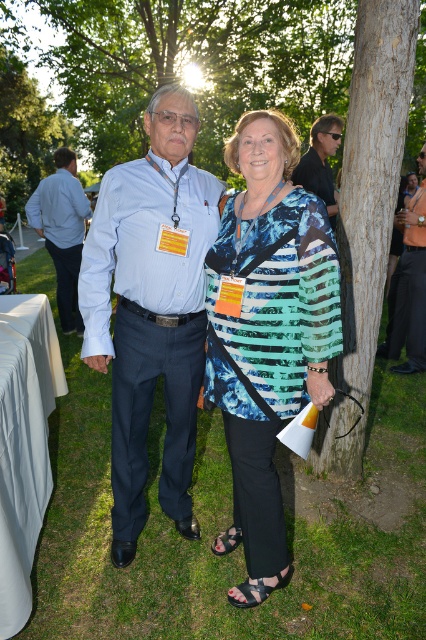
You are a photographer at the event and want to ensure that both the printed fabric top at center and the matte blue shirt at center are clearly visible in your photo. Given that your camera has a minimum focus distance of 12 inches, will you need to adjust your position to capture both subjects adequately?

The printed fabric top at center and the matte blue shirt at center are 12.47 inches apart from each other. Since the distance between them is greater than the camera minimum focus distance of 12 inches, you can capture both subjects without needing to adjust your position.

In the scene shown: You are a photographer adjusting your camera settings to ensure both the printed fabric top at center and the matte black sunglasses at upper center are in focus. Considering their sizes, which object should you prioritize focusing on first?

The printed fabric top at center is much taller than the matte black sunglasses at upper center, so you should prioritize focusing on the printed fabric top at center first since it is larger and might require more precise focus.

You are a photographer adjusting your camera settings to focus on the matte blue shirt at center and the matte black sunglasses at upper center. Which object should you focus on first to ensure proper depth of field?

The matte blue shirt at center is closer to the viewer than the matte black sunglasses at upper center, so you should focus on the matte blue shirt at center first to ensure proper depth of field.